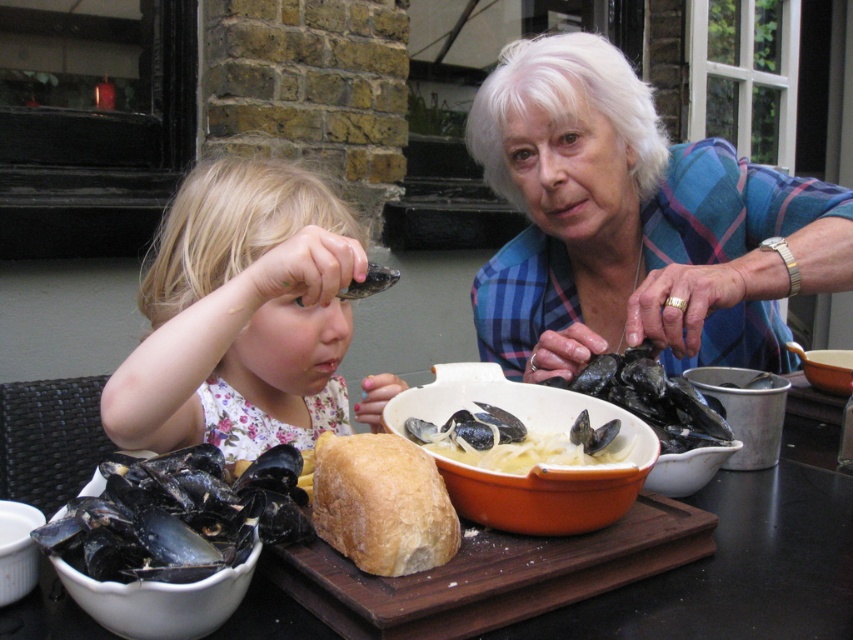
You are a photographer holding a camera and want to take a picture of the blue plaid shirt at upper right. Given that the camera has a minimum focusing distance of 30 inches, can you take a clear photo without moving either the camera or the shirt?

The blue plaid shirt at upper right and camera are 33.21 inches apart from each other, which is beyond the camera minimum focusing distance of 30 inches. Therefore, you can take a clear photo without moving either the camera or the shirt.

You are a guest at this outdoor dining event and need to decide where to place your drink. The blue plaid shirt at upper right and the wooden cutting board at center are both on the table. Which object should you avoid placing your drink near to prevent it from being too close to a larger item?

You should avoid placing your drink near the blue plaid shirt at upper right because it is larger in size than the wooden cutting board at center, so it occupies more space and could cause the drink to be too close to a larger object.

You are a photographer taking a picture of the dining table. You notice a point marked at coordinates (x=241, y=314) on the blonde hair at left. If you want to focus on the pasta with mussels and creamy sauce, should you move your camera lens upward or downward from this point?

The point at (x=241, y=314) is on the blonde hair at left. Since the pasta with mussels and creamy sauce is in the foreground on the wooden serving board, you should move the camera lens downward from this point to focus on it.